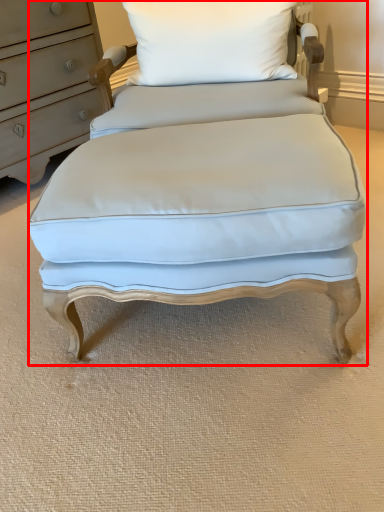
Question: From the image's perspective, what is the correct spatial relationship of swivel chair (annotated by the red box) in relation to pillow?

Choices:
 (A) above
 (B) below

Answer: (B)